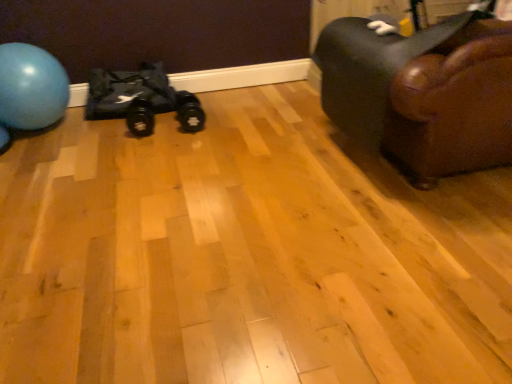
Question: Is black fabric bag at left turned away from blue rubber ball at left?

Choices:
 (A) yes
 (B) no

Answer: (B)

Question: Considering the relative sizes of black fabric bag at left and blue rubber ball at left in the image provided, is black fabric bag at left shorter than blue rubber ball at left?

Choices:
 (A) yes
 (B) no

Answer: (A)

Question: From a real-world perspective, is black fabric bag at left positioned over blue rubber ball at left based on gravity?

Choices:
 (A) yes
 (B) no

Answer: (B)

Question: Is black fabric bag at left far away from blue rubber ball at left?

Choices:
 (A) yes
 (B) no

Answer: (B)

Question: Considering the relative sizes of black fabric bag at left and blue rubber ball at left in the image provided, is black fabric bag at left bigger than blue rubber ball at left?

Choices:
 (A) no
 (B) yes

Answer: (A)

Question: From a real-world perspective, is brown leather couch at right physically located above or below blue rubber ball at left?

Choices:
 (A) below
 (B) above

Answer: (B)

Question: Looking at their shapes, would you say brown leather couch at right is wider or thinner than blue rubber ball at left?

Choices:
 (A) thin
 (B) wide

Answer: (B)

Question: Does point coord(494,152) appear closer or farther from the camera than point coord(49,52)?

Choices:
 (A) closer
 (B) farther

Answer: (A)

Question: Would you say brown leather couch at right is to the left or to the right of blue rubber ball at left in the picture?

Choices:
 (A) left
 (B) right

Answer: (B)

Question: Which is correct: black fabric bag at left is inside black rubber dumbbell at center, arranged as the second footwear when viewed from the right, or outside of it?

Choices:
 (A) inside
 (B) outside

Answer: (B)

Question: Considering the positions of black fabric bag at left and black rubber dumbbell at center, marked as the first footwear in a left-to-right arrangement, in the image, is black fabric bag at left wider or thinner than black rubber dumbbell at center, marked as the first footwear in a left-to-right arrangement,?

Choices:
 (A) wide
 (B) thin

Answer: (A)

Question: From the image's perspective, relative to black rubber dumbbell at center, marked as the first footwear in a left-to-right arrangement, is black fabric bag at left above or below?

Choices:
 (A) above
 (B) below

Answer: (A)

Question: Based on their positions, is black fabric bag at left located to the left or right of black rubber dumbbell at center, marked as the first footwear in a left-to-right arrangement?

Choices:
 (A) right
 (B) left

Answer: (B)

Question: Considering their positions, is black rubber dumbbell at center, marked as the first footwear in a left-to-right arrangement, located in front of or behind black rubber dumbbell at center, which is the 1th footwear from right to left?

Choices:
 (A) front
 (B) behind

Answer: (A)

Question: From the image's perspective, is black rubber dumbbell at center, arranged as the second footwear when viewed from the right, located above or below black rubber dumbbell at center, which is the 1th footwear from right to left?

Choices:
 (A) above
 (B) below

Answer: (B)